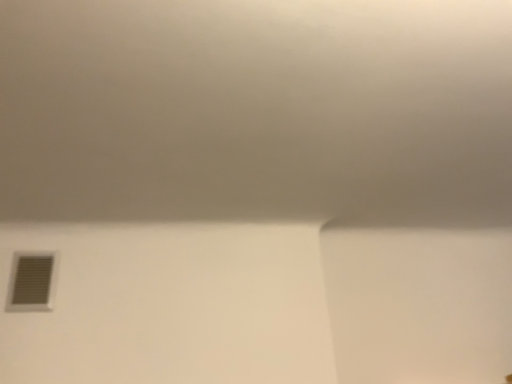
Question: Should I look upward or downward to see matte gray vent at lower left?

Choices:
 (A) down
 (B) up

Answer: (A)